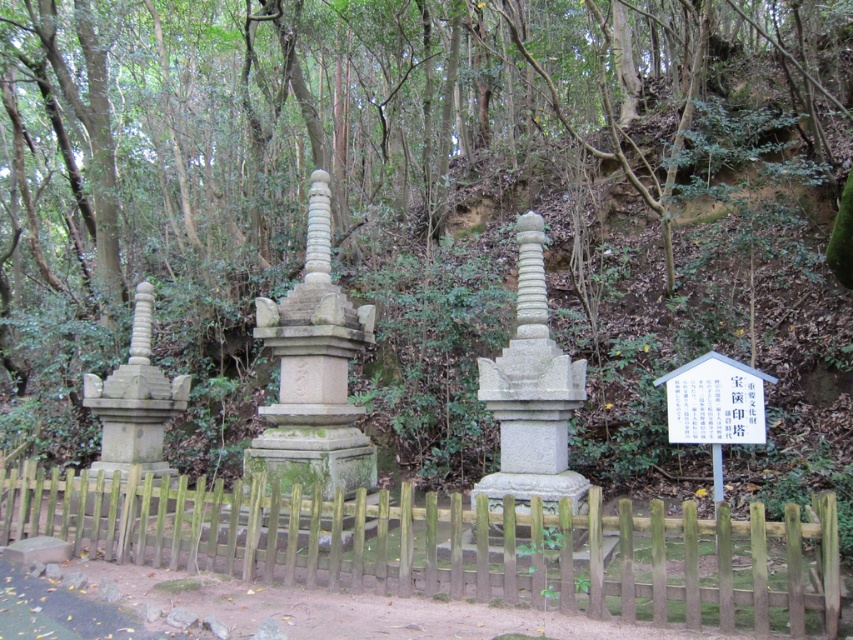
Is brown wooden fence at center in front of gray stone pillar at center?

No, it is not.

Looking at this image, who is positioned more to the left, brown wooden fence at center or gray stone pillar at center?

brown wooden fence at center

Which is behind, point (206, 563) or point (558, 490)?

The point (558, 490) is more distant.

The height and width of the screenshot is (640, 853). I want to click on brown wooden fence at center, so 426,541.

Is brown wooden fence at center to the left of gray stone pagoda at center from the viewer's perspective?

Indeed, brown wooden fence at center is positioned on the left side of gray stone pagoda at center.

This screenshot has width=853, height=640. What do you see at coordinates (426, 541) in the screenshot?
I see `brown wooden fence at center` at bounding box center [426, 541].

At what (x,y) coordinates should I click in order to perform the action: click on brown wooden fence at center. Please return your answer as a coordinate pair (x, y). Looking at the image, I should click on (426, 541).

Between gray stone pagoda at center and gray stone pillar at center, which one is positioned higher?

Positioned higher is gray stone pagoda at center.

At what (x,y) coordinates should I click in order to perform the action: click on gray stone pagoda at center. Please return your answer as a coordinate pair (x, y). Image resolution: width=853 pixels, height=640 pixels. Looking at the image, I should click on (312, 372).